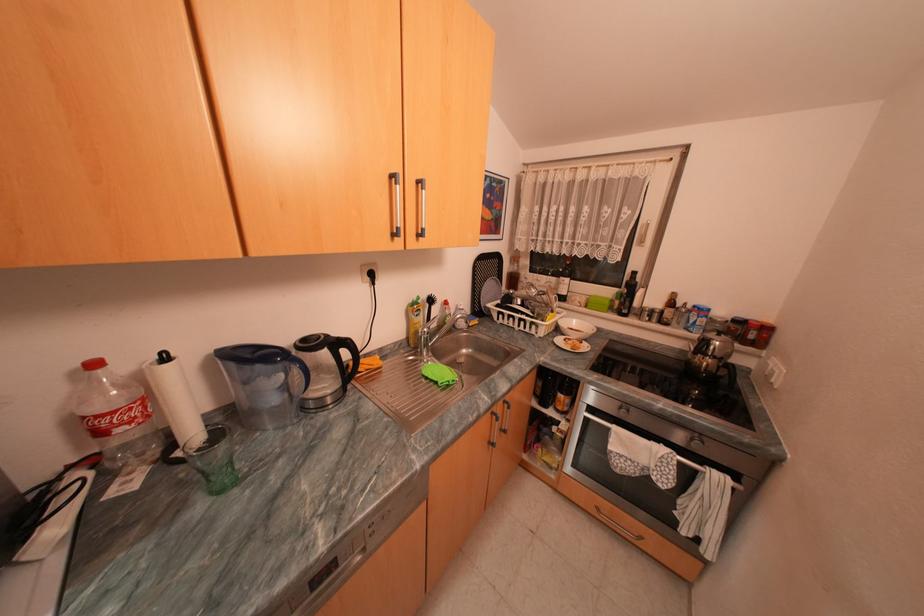
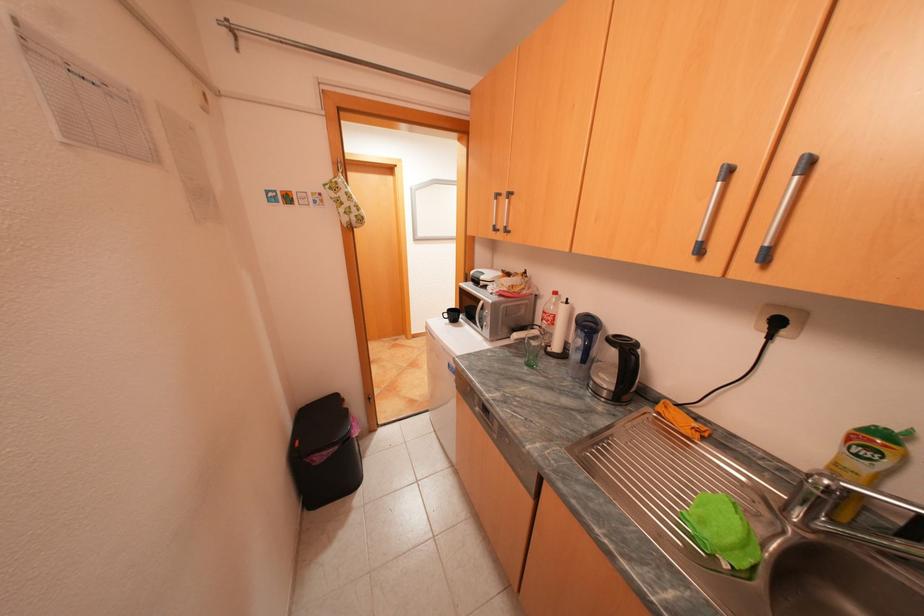
Locate, in the second image, the point that corresponds to point 382,274 in the first image.

(786, 323)